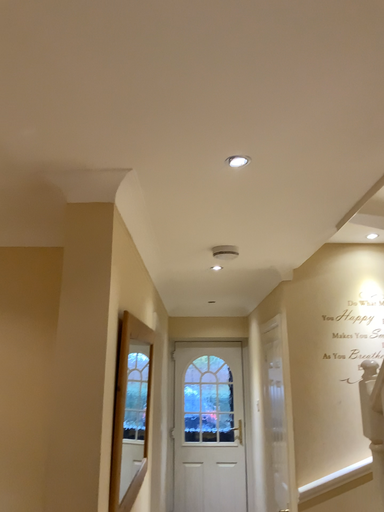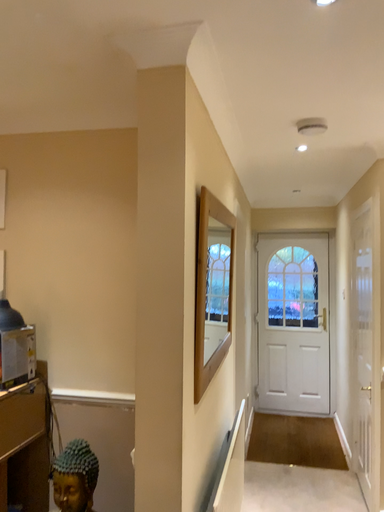
Question: How did the camera likely rotate when shooting the video?

Choices:
 (A) rotated left
 (B) rotated right

Answer: (A)